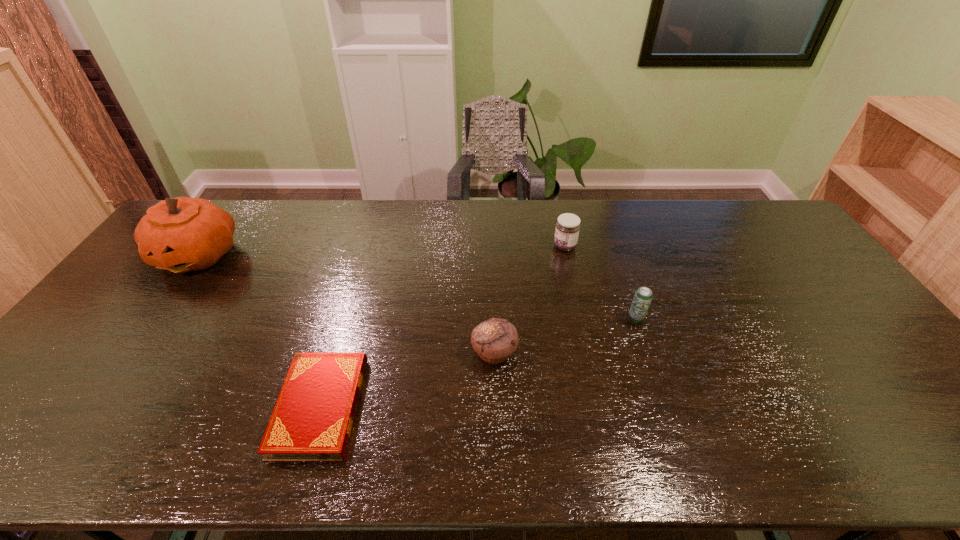
Locate an element on the screen. The height and width of the screenshot is (540, 960). vacant region located 0.210m on the front label of the fourth object from left to right is located at coordinates (491, 246).

This screenshot has width=960, height=540. Find the location of `vacant space situated on the front label of the fourth object from left to right`. vacant space situated on the front label of the fourth object from left to right is located at coordinates (464, 246).

The image size is (960, 540). I want to click on free space located on the left of the third nearest object, so click(x=507, y=319).

The height and width of the screenshot is (540, 960). In order to click on vacant point located 0.240m on the back of the muffin in this screenshot , I will do click(492, 276).

Find the location of a particular element. pumpkin that is at the far edge is located at coordinates (181, 234).

Where is `jam present at the far edge`? jam present at the far edge is located at coordinates (567, 230).

The image size is (960, 540). I want to click on object at the near edge, so point(312,420).

Identify the location of object situated at the left edge. (181, 234).

Find the location of a particular element. object present at the far left corner is located at coordinates (181, 234).

In the image, there is a desktop. What are the coordinates of `vacant region at the far edge` in the screenshot? It's located at pos(541,204).